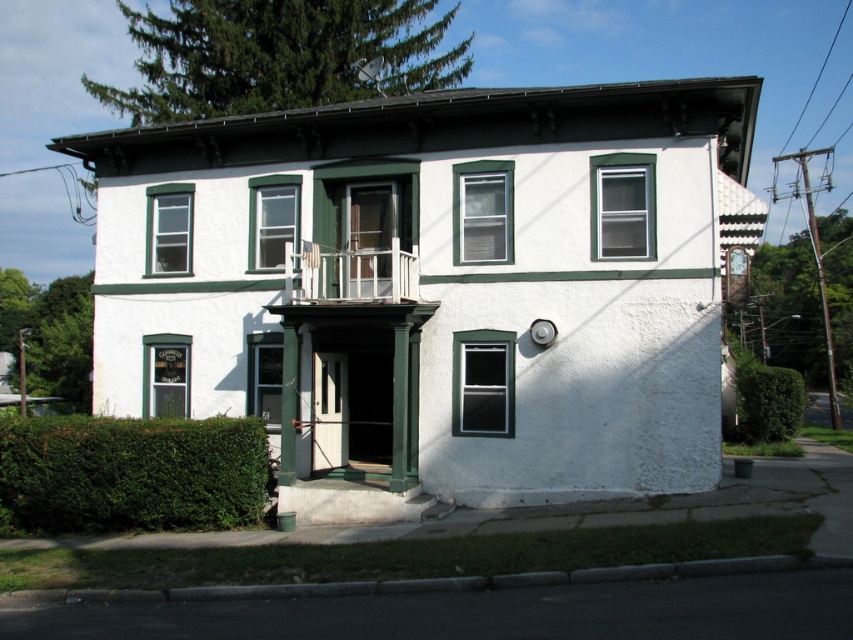
You are a painter who needs to estimate the amount of paint required for the green painted wood trim at center and the green leafy hedge at lower left. Based on their sizes, which one will require more paint?

The green painted wood trim at center is bigger than the green leafy hedge at lower left, so it will require more paint.

Consider the image. You are a painter hired to paint the green painted wood trim at center and the green leafy hedge at lower left. Which object requires a ladder to paint?

The green painted wood trim at center requires a ladder to paint because it is much taller than the green leafy hedge at lower left.

You are standing on the sidewalk in front of the building and looking at two points marked on the building facade. The first point is at coordinates point (311, 458) and the second is at point (90, 502). Which point is closer to you as you stand on the sidewalk?

Point (311, 458) is closer to you because it is further to the viewer than point (90, 502).